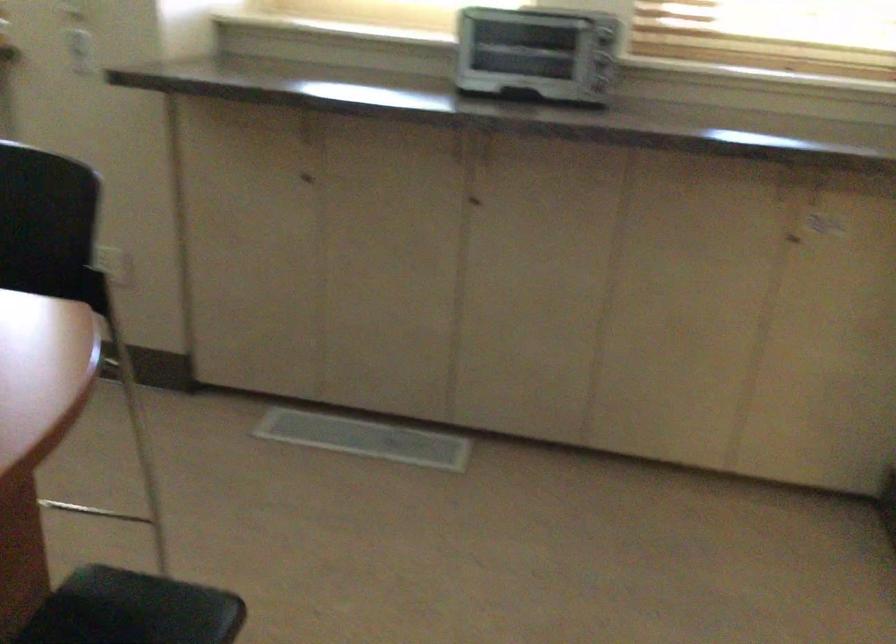
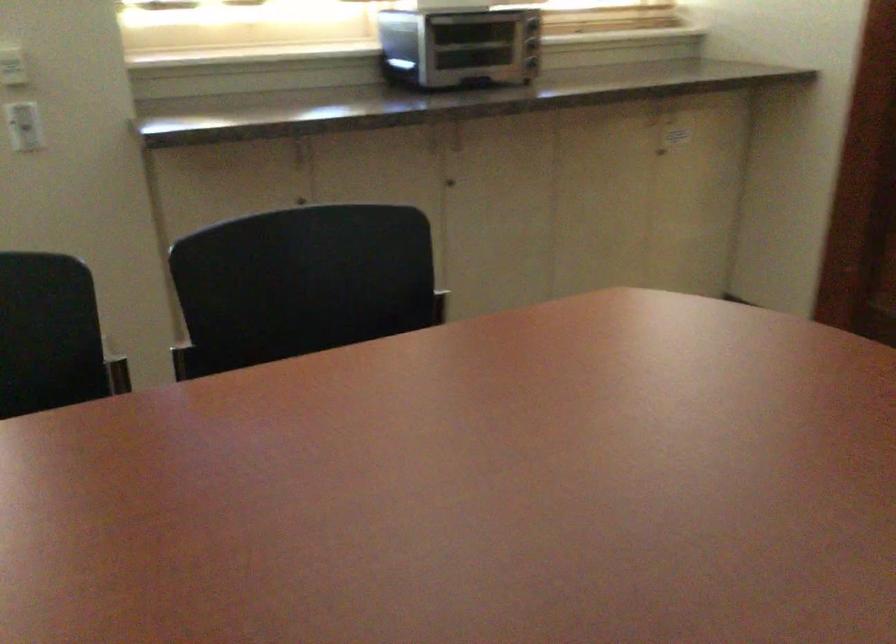
Where in the second image is the point corresponding to point 471,205 from the first image?

(450, 183)